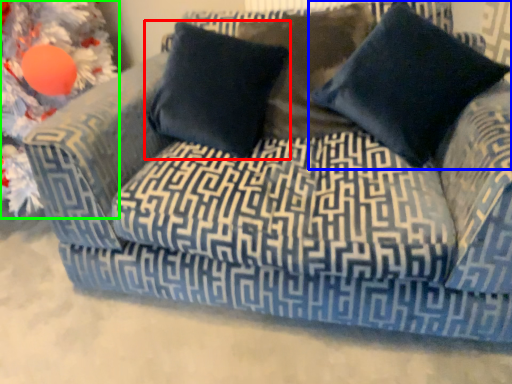
Question: Considering the real-world distances, which object is closest to pillow (highlighted by a red box)? pillow (highlighted by a blue box) or christmas decoration (highlighted by a green box).

Choices:
 (A) pillow
 (B) christmas decoration

Answer: (A)